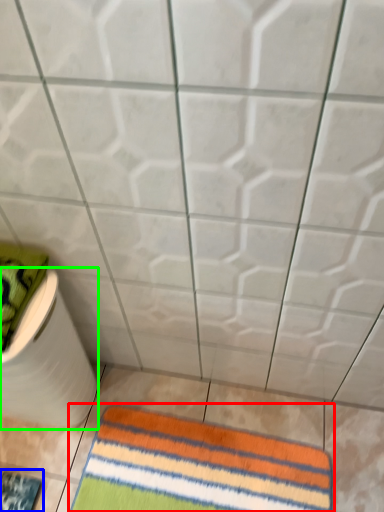
Question: Considering the real-world distances, which object is closest to towel (highlighted by a red box)? mat (highlighted by a blue box) or toilet paper (highlighted by a green box).

Choices:
 (A) mat
 (B) toilet paper

Answer: (B)